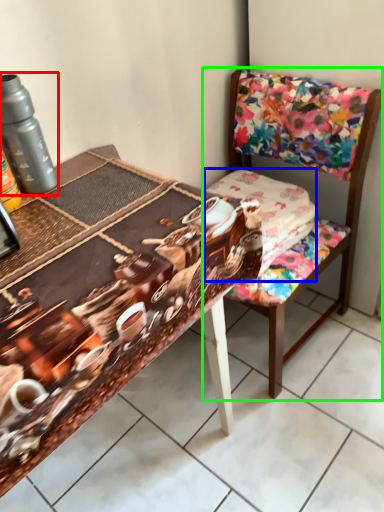
Question: Which object is positioned farthest from bottle (highlighted by a red box)? Select from fabric (highlighted by a blue box) and chair (highlighted by a green box).

Choices:
 (A) fabric
 (B) chair

Answer: (B)